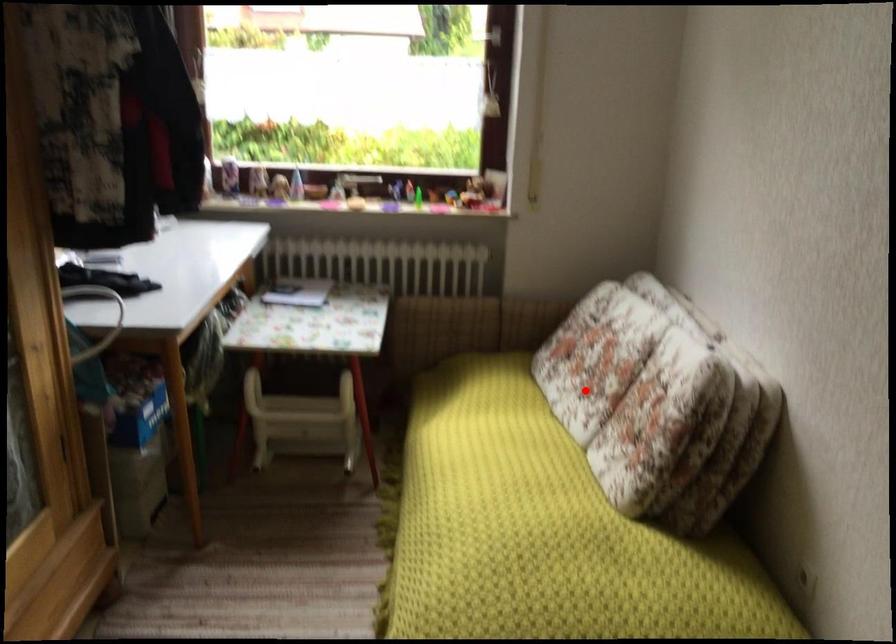
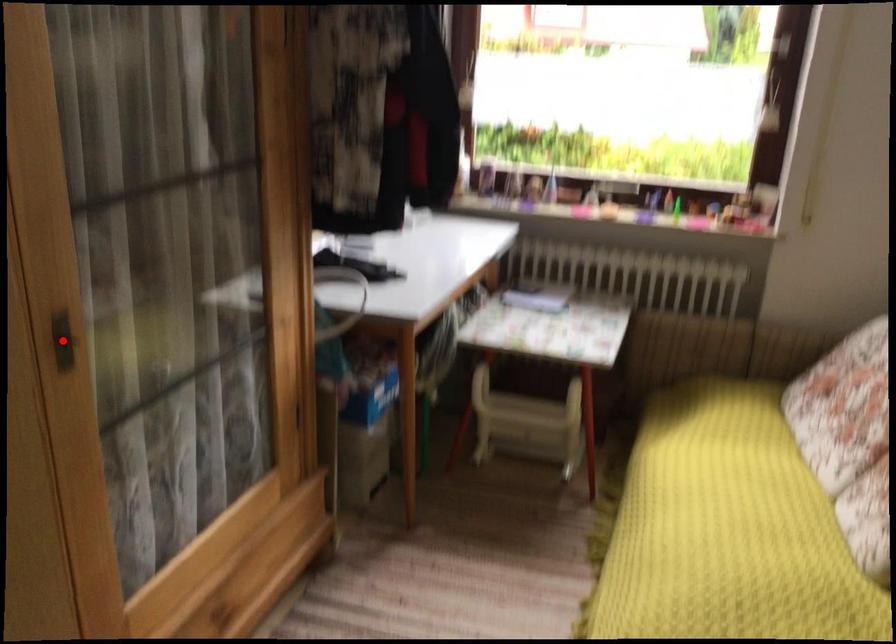
I am providing you with two images of the same scene from different viewpoints. A red point is marked on the first image and another point is marked on the second image. Do the highlighted points in image1 and image2 indicate the same real-world spot?

No